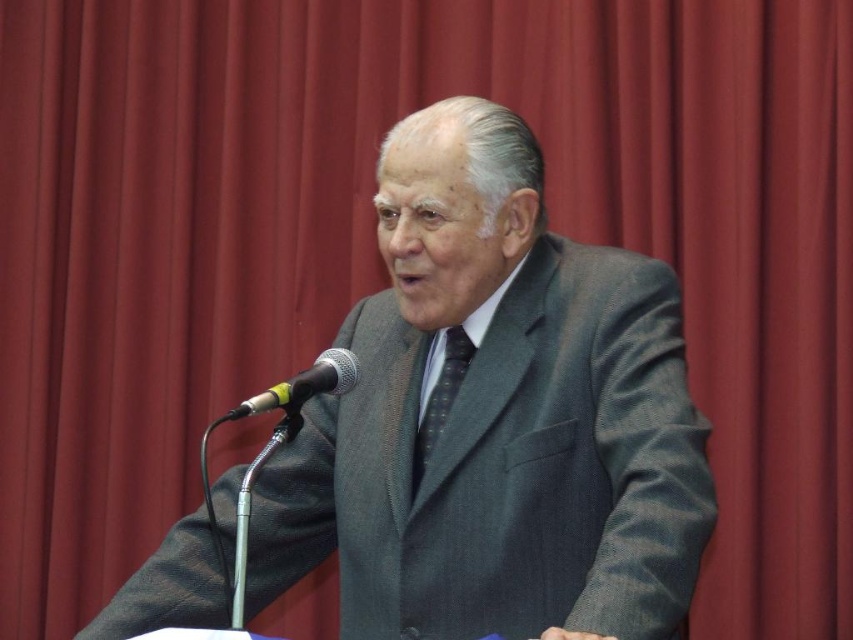
Question: Which of the following is the farthest from the observer?

Choices:
 (A) (403, 230)
 (B) (250, 408)
 (C) (415, 488)

Answer: (C)

Question: Is gray textured suit at center above silver metallic microphone at center?

Choices:
 (A) no
 (B) yes

Answer: (A)

Question: In this image, where is gray textured suit at center located relative to silver metallic microphone at center?

Choices:
 (A) below
 (B) above

Answer: (A)

Question: Among these points, which one is nearest to the camera?

Choices:
 (A) (341, 381)
 (B) (422, 413)
 (C) (426, 284)

Answer: (A)

Question: Is gray textured suit at center thinner than silver metallic microphone at center?

Choices:
 (A) yes
 (B) no

Answer: (B)

Question: Among these objects, which one is nearest to the camera?

Choices:
 (A) dark gray textured tie at center
 (B) silver metallic microphone at center

Answer: (B)